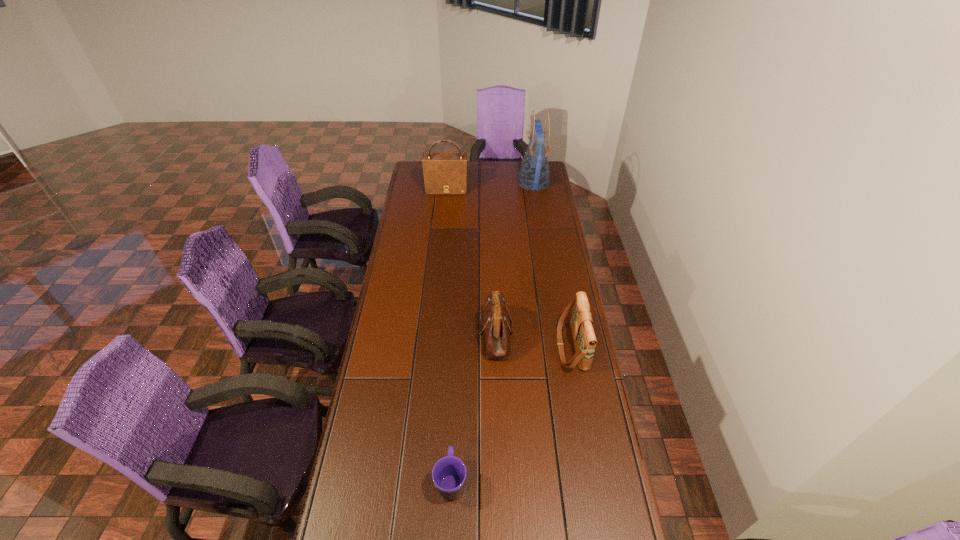
At what (x,y) coordinates should I click in order to perform the action: click on shopping bag. Please return your answer as a coordinate pair (x, y). The width and height of the screenshot is (960, 540). Looking at the image, I should click on (534, 174).

Identify the location of the leftmost shoulder bag. The image size is (960, 540). (444, 173).

You are a GUI agent. You are given a task and a screenshot of the screen. Output one action in this format:
    pyautogui.click(x=<x>, y=<y>)
    Task: Click on the farthest shoulder bag
    This screenshot has height=540, width=960.
    Given the screenshot: What is the action you would take?
    pyautogui.click(x=444, y=173)

Find the location of a particular element. the second shoulder bag from right to left is located at coordinates (496, 325).

The image size is (960, 540). I want to click on the rightmost shoulder bag, so click(581, 322).

Locate an element on the screen. the shortest object is located at coordinates (449, 473).

The width and height of the screenshot is (960, 540). In order to click on the nearest object in this screenshot , I will do `click(449, 473)`.

Image resolution: width=960 pixels, height=540 pixels. I want to click on free space located 0.280m on the left of the tallest object, so click(x=466, y=183).

This screenshot has height=540, width=960. I want to click on free space located on the front flap of the leftmost shoulder bag, so click(444, 219).

In order to click on blank space located 0.210m on the right of the second shoulder bag from right to left in this screenshot , I will do `click(569, 334)`.